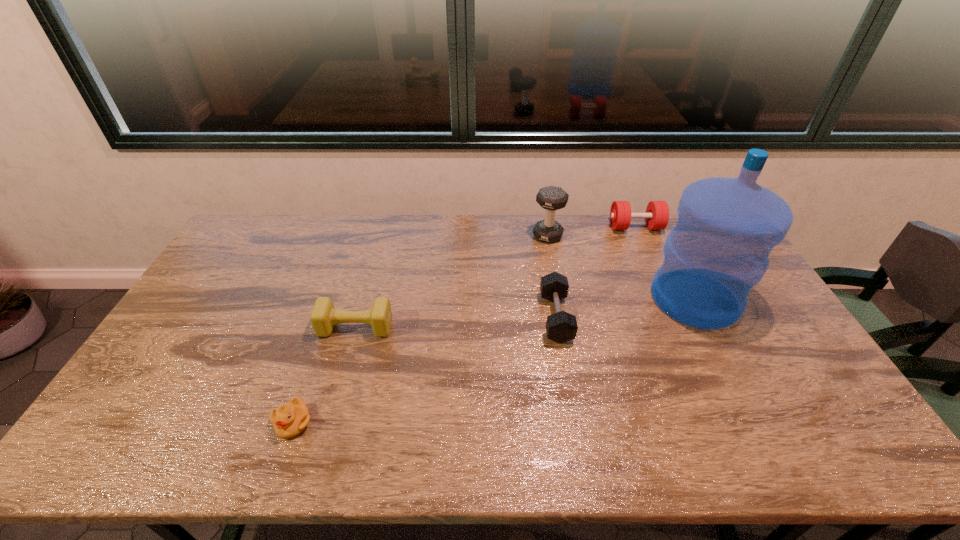
Identify the location of the tallest object. (719, 249).

Identify the location of the fifth shortest object. Image resolution: width=960 pixels, height=540 pixels. (552, 198).

Identify the location of the rightmost dumbbell. (657, 212).

Where is `the leftmost dumbbell`? The height and width of the screenshot is (540, 960). the leftmost dumbbell is located at coordinates (324, 316).

Where is `the shortest object`? The image size is (960, 540). the shortest object is located at coordinates (290, 419).

This screenshot has height=540, width=960. What are the coordinates of `the nearest object` in the screenshot? It's located at (290, 419).

You are a GUI agent. You are given a task and a screenshot of the screen. Output one action in this format:
    pyautogui.click(x=<x>, y=<y>)
    Task: Click on the free space located on the back of the water jug
    
    Given the screenshot: What is the action you would take?
    pyautogui.click(x=660, y=229)

Locate an element on the screen. This screenshot has height=540, width=960. free location located on the right of the second tallest object is located at coordinates (659, 236).

The height and width of the screenshot is (540, 960). Identify the location of vacant space located 0.290m on the front of the rightmost dumbbell. (662, 289).

This screenshot has height=540, width=960. I want to click on free space located 0.270m on the left of the leftmost dumbbell, so click(229, 327).